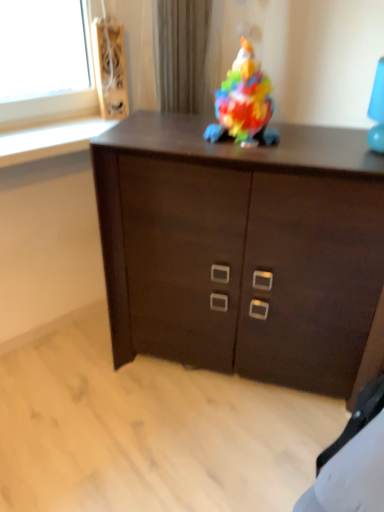
Where is `free space in front of dark wood cabinet at center`? This screenshot has height=512, width=384. free space in front of dark wood cabinet at center is located at coordinates [222, 449].